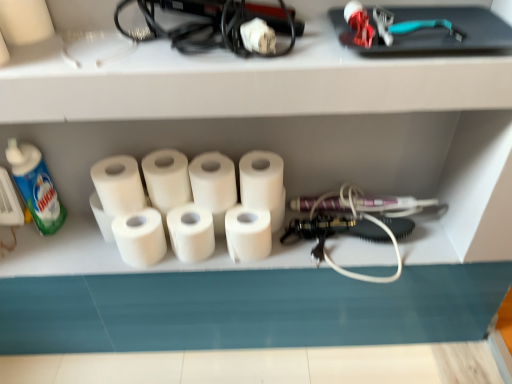
Question: Which direction should I rotate to face white matte toilet paper at center, the fifth toilet paper positioned from the right, — up or down?

Choices:
 (A) up
 (B) down

Answer: (B)

Question: Which direction should I rotate to look at white matte toilet paper at center, which is counted as the third toilet paper, starting from the left, — up or down?

Choices:
 (A) down
 (B) up

Answer: (B)

Question: Is white matte toilet paper at center, the sixth toilet paper in the right-to-left sequence, at the left side of white matte paper towel at center?

Choices:
 (A) yes
 (B) no

Answer: (A)

Question: From a real-world perspective, is white matte toilet paper at center, the sixth toilet paper in the right-to-left sequence, located beneath white matte paper towel at center?

Choices:
 (A) no
 (B) yes

Answer: (A)

Question: Does white matte toilet paper at center, marked as the first toilet paper in a left-to-right arrangement, turn towards white matte paper towel at center?

Choices:
 (A) no
 (B) yes

Answer: (A)

Question: From the image's perspective, would you say white matte toilet paper at center, marked as the first toilet paper in a left-to-right arrangement, is positioned over white matte paper towel at center?

Choices:
 (A) no
 (B) yes

Answer: (B)

Question: Does white matte toilet paper at center, marked as the first toilet paper in a left-to-right arrangement, appear on the right side of white matte paper towel at center?

Choices:
 (A) yes
 (B) no

Answer: (B)

Question: Would you consider white matte toilet paper at center, the sixth toilet paper in the right-to-left sequence, to be distant from white matte paper towel at center?

Choices:
 (A) no
 (B) yes

Answer: (A)

Question: Can you confirm if white matte toilet paper at center, positioned as the sixth toilet paper in left-to-right order, is thinner than white matte toilet paper at center, the 2th toilet paper viewed from the right?

Choices:
 (A) yes
 (B) no

Answer: (B)

Question: Is white matte toilet paper at center, the first toilet paper in the right-to-left sequence, in contact with white matte toilet paper at center, marked as the 5th toilet paper in a left-to-right arrangement?

Choices:
 (A) yes
 (B) no

Answer: (A)

Question: Does white matte toilet paper at center, the first toilet paper in the right-to-left sequence, lie behind white matte toilet paper at center, the 2th toilet paper viewed from the right?

Choices:
 (A) yes
 (B) no

Answer: (B)

Question: From the image's perspective, is white matte toilet paper at center, the first toilet paper in the right-to-left sequence, beneath white matte toilet paper at center, marked as the 5th toilet paper in a left-to-right arrangement?

Choices:
 (A) yes
 (B) no

Answer: (B)

Question: Considering the relative sizes of white matte toilet paper at center, the first toilet paper in the right-to-left sequence, and white matte toilet paper at center, marked as the 5th toilet paper in a left-to-right arrangement, in the image provided, is white matte toilet paper at center, the first toilet paper in the right-to-left sequence, shorter than white matte toilet paper at center, marked as the 5th toilet paper in a left-to-right arrangement,?

Choices:
 (A) no
 (B) yes

Answer: (A)

Question: Is white matte toilet paper at center, positioned as the sixth toilet paper in left-to-right order, smaller than white matte toilet paper at center, the 2th toilet paper viewed from the right?

Choices:
 (A) no
 (B) yes

Answer: (A)

Question: From the image's perspective, is white matte toilet paper at center, which is counted as the third toilet paper, starting from the left, located beneath white matte toilet paper at center, which ranks as the 3th toilet paper in right-to-left order?

Choices:
 (A) no
 (B) yes

Answer: (A)